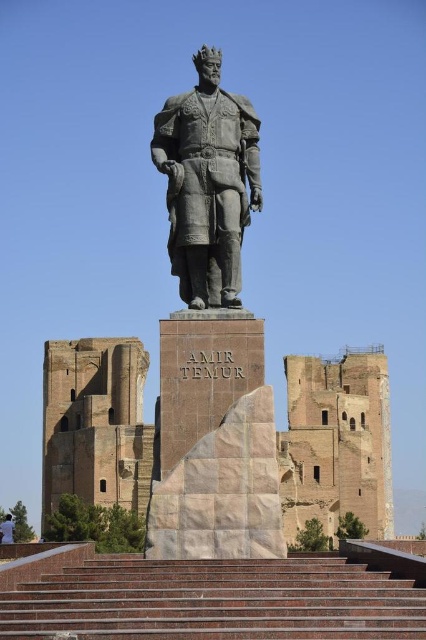
Question: Can you confirm if bronze statue at center is positioned below white cotton shirt at lower left?

Choices:
 (A) no
 (B) yes

Answer: (A)

Question: Which is farther from the white cotton shirt at lower left?

Choices:
 (A) bronze statue at center
 (B) brown stone stairs at center

Answer: (B)

Question: Among these objects, which one is nearest to the camera?

Choices:
 (A) white cotton shirt at lower left
 (B) brown stone stairs at center
 (C) bronze statue at center

Answer: (B)

Question: Can you confirm if brown stone stairs at center is thinner than white cotton shirt at lower left?

Choices:
 (A) yes
 (B) no

Answer: (A)

Question: From the image, what is the correct spatial relationship of bronze statue at center in relation to white cotton shirt at lower left?

Choices:
 (A) above
 (B) below

Answer: (A)

Question: Among these points, which one is nearest to the camera?

Choices:
 (A) (380, 573)
 (B) (9, 524)

Answer: (A)